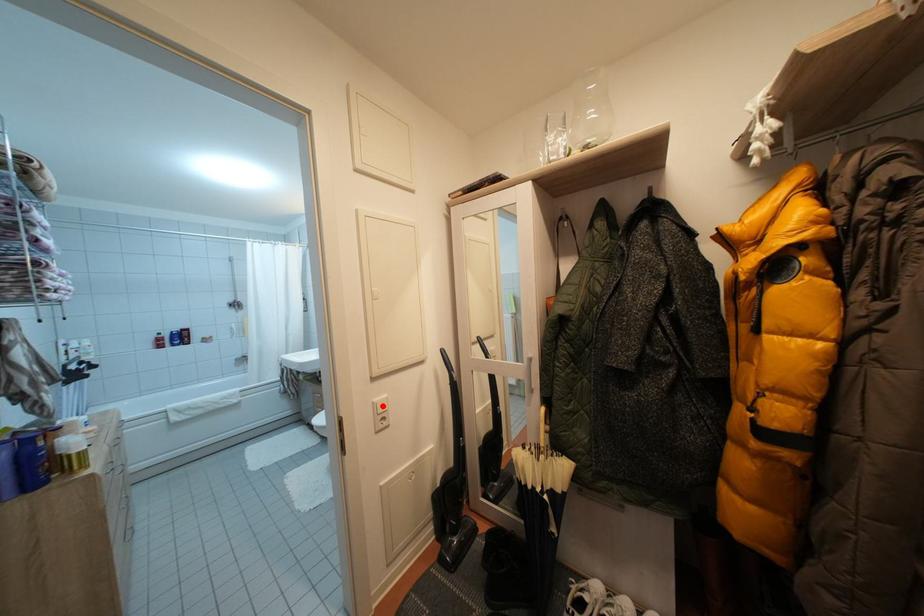
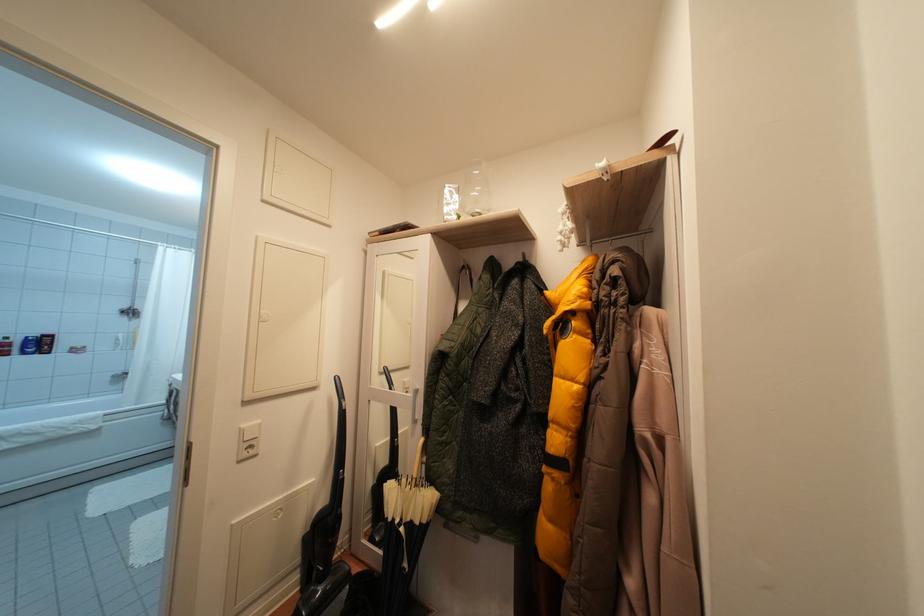
In the second image, find the point that corresponds to the highlighted location in the first image.

(250, 431)